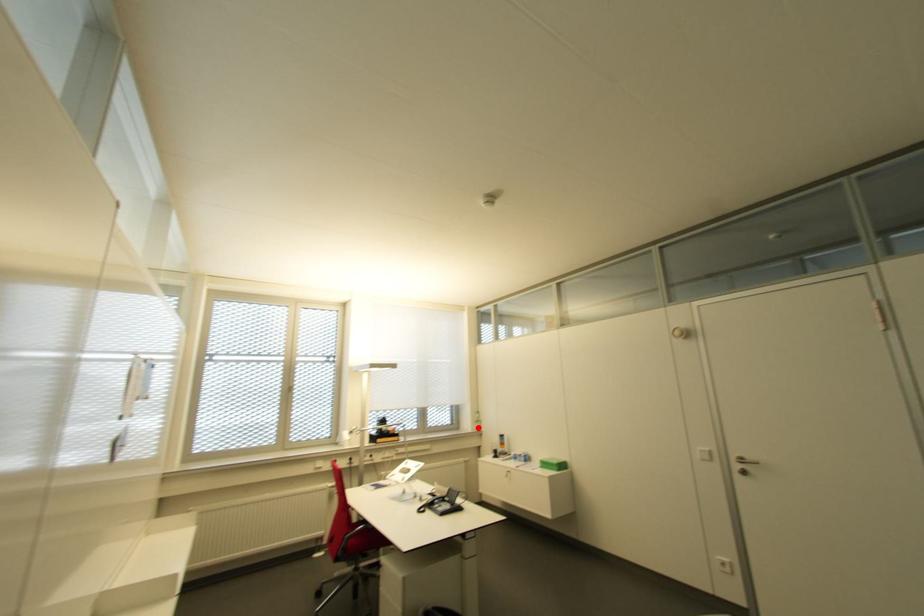
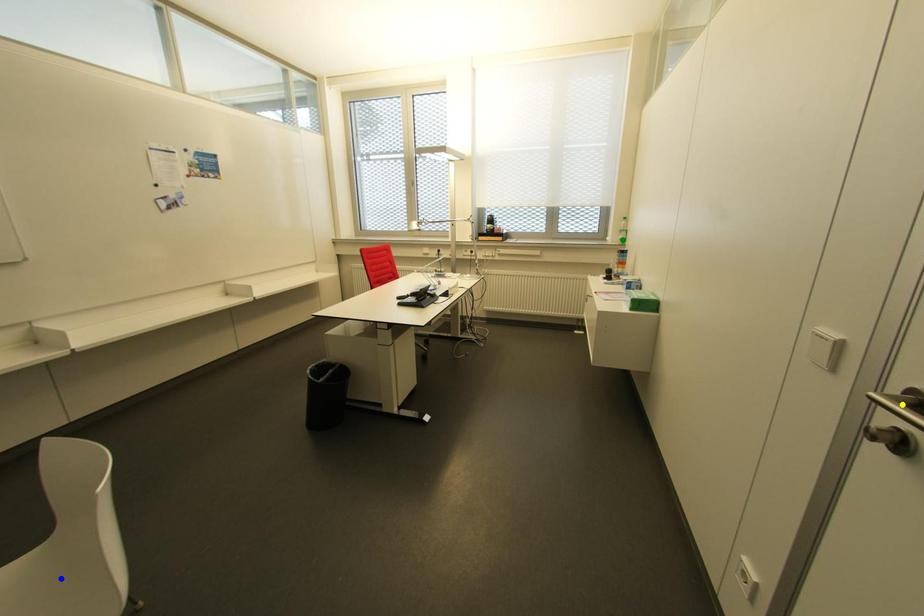
Question: I am providing you with two images of the same scene from different viewpoints. A red point is marked on the first image. You are given multiple points on the second image. Which mark in image 2 goes with the point in image 1?

Choices:
 (A) green point
 (B) blue point
 (C) yellow point

Answer: (A)